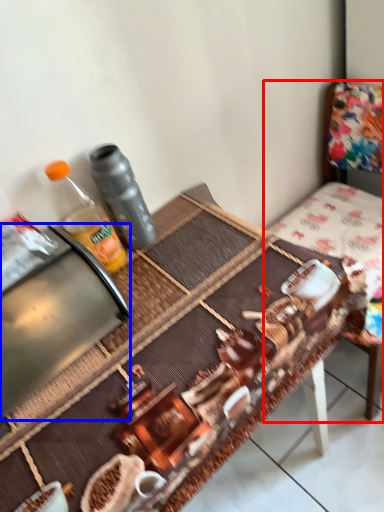
Question: Which object is further to the camera taking this photo, chair (highlighted by a red box) or appliance (highlighted by a blue box)?

Choices:
 (A) chair
 (B) appliance

Answer: (A)